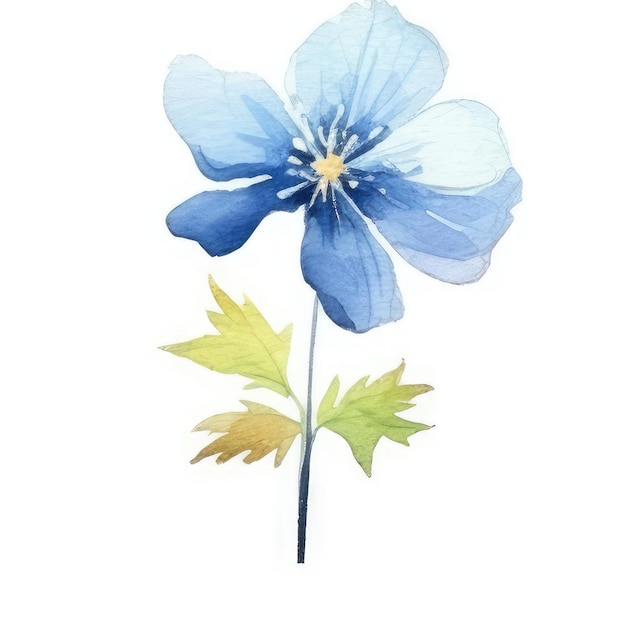
What are the coordinates of `art` in the screenshot? It's located at (392, 394).